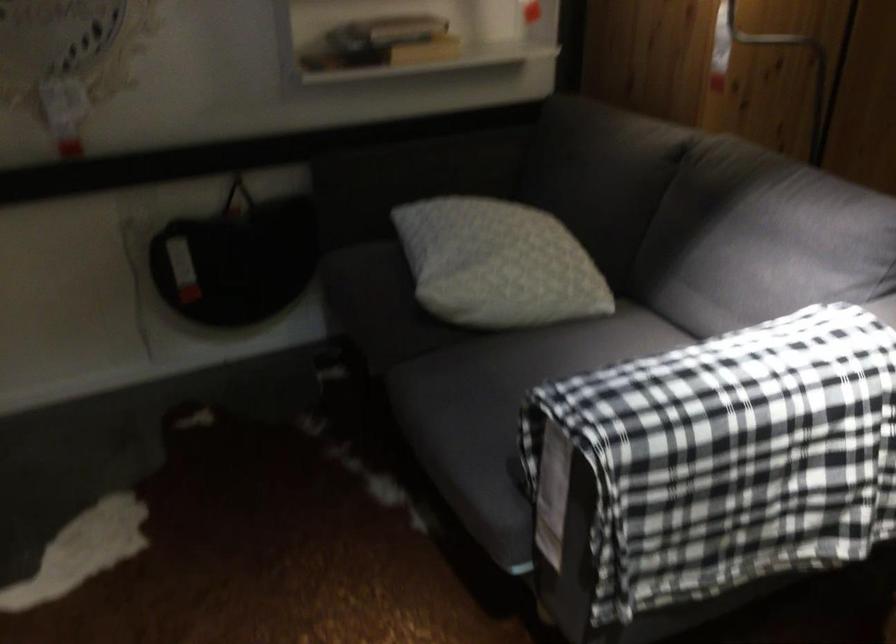
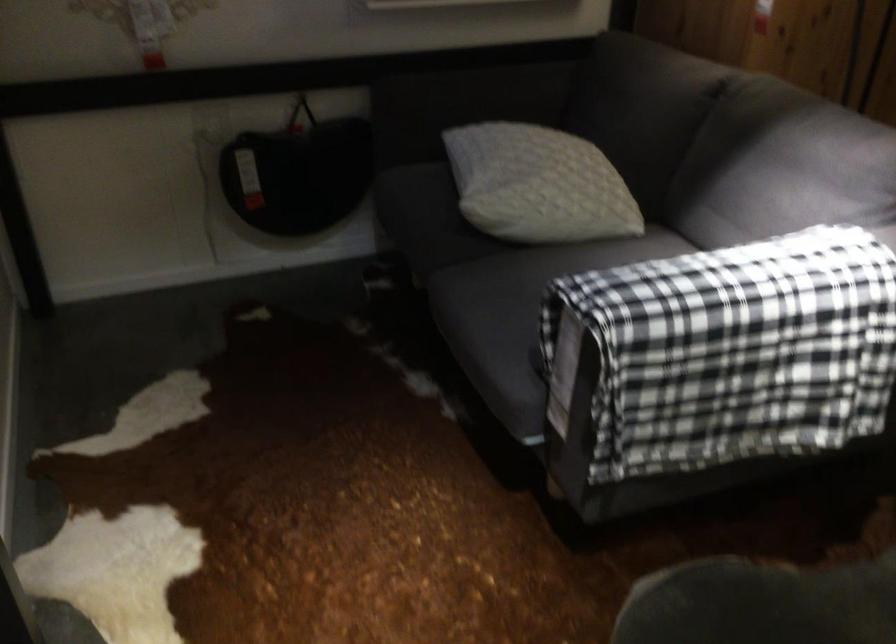
Find the pixel in the second image that matches (502,269) in the first image.

(538, 185)